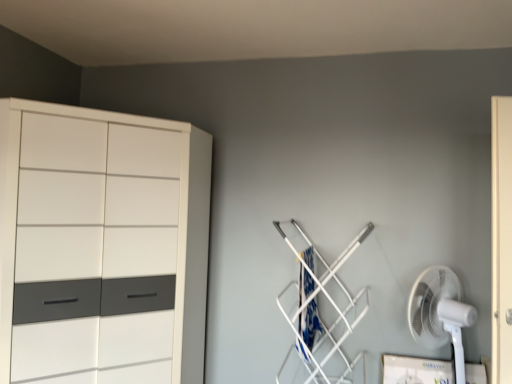
Question: From the image's perspective, relative to blue fabric laundry at center-right, is white plastic fan at lower right above or below?

Choices:
 (A) above
 (B) below

Answer: (B)

Question: Is white plastic fan at lower right wider or thinner than blue fabric laundry at center-right?

Choices:
 (A) thin
 (B) wide

Answer: (A)

Question: Considering the real-world distances, which object is closest to the white glossy cupboard at left?

Choices:
 (A) white plastic fan at lower right
 (B) blue fabric laundry at center-right

Answer: (B)

Question: Estimate the real-world distances between objects in this image. Which object is farther from the white plastic fan at lower right?

Choices:
 (A) blue fabric laundry at center-right
 (B) white glossy cupboard at left

Answer: (B)